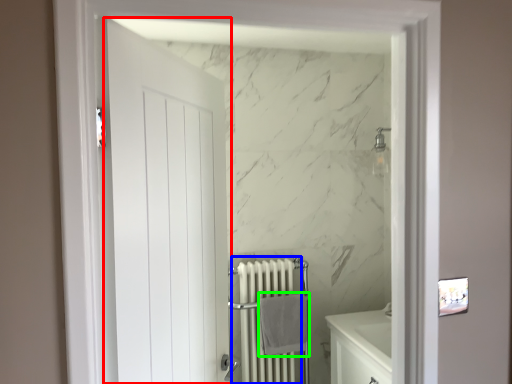
Question: Considering the real-world distances, which object is farthest from door (highlighted by a red box)? radiator (highlighted by a blue box) or bath towel (highlighted by a green box)?

Choices:
 (A) radiator
 (B) bath towel

Answer: (A)